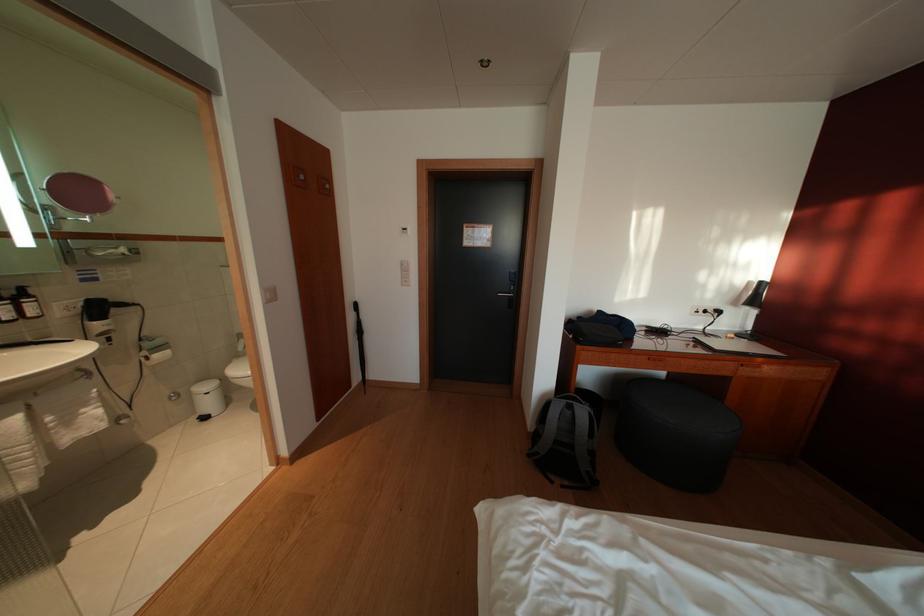
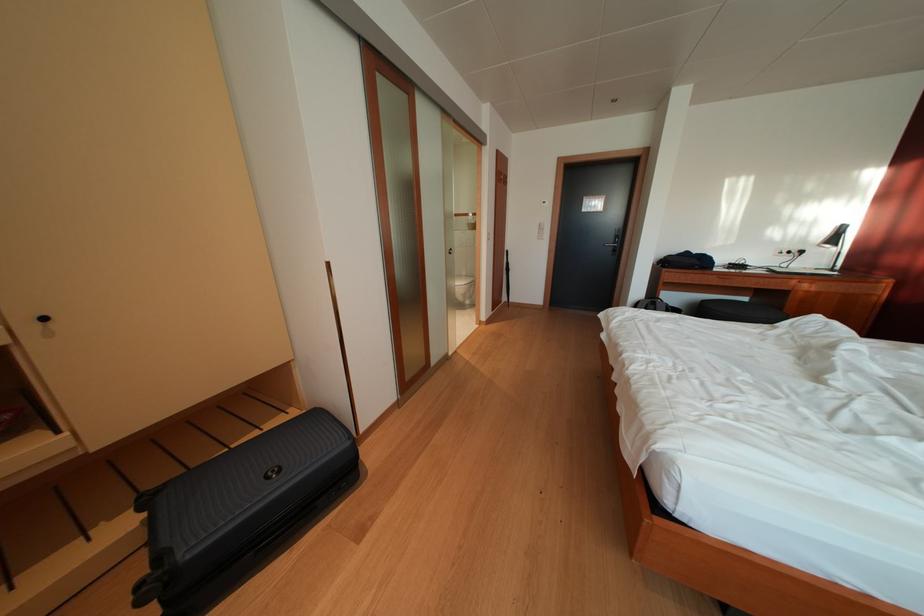
Where in the second image is the point corresponding to (726,318) from the first image?

(809, 257)